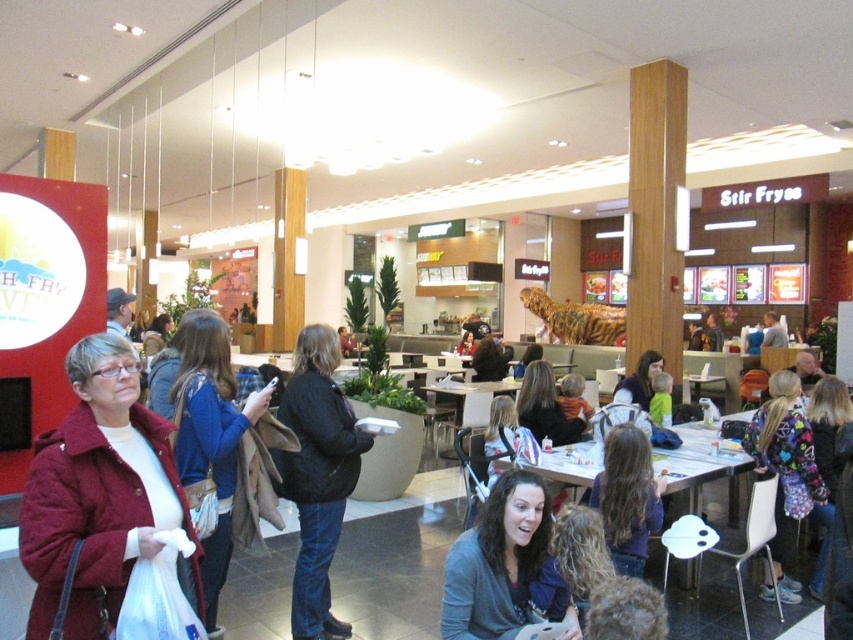
Question: Observing the image, what is the correct spatial positioning of blue fabric jacket at left in reference to white plastic table at center?

Choices:
 (A) left
 (B) right

Answer: (A)

Question: Which object appears farthest from the camera in this image?

Choices:
 (A) multicolored fleece jacket at lower right
 (B) blue fabric jacket at left
 (C) white plastic table at center
 (D) matte black jacket at center

Answer: (D)

Question: Does black matte jacket at center appear under matte black jacket at center?

Choices:
 (A) no
 (B) yes

Answer: (B)

Question: Which object is closer to the camera taking this photo?

Choices:
 (A) multicolored fleece jacket at lower right
 (B) black matte jacket at center

Answer: (B)

Question: Is dark purple sweater at center above matte black jacket at center?

Choices:
 (A) no
 (B) yes

Answer: (A)

Question: Which point is closer to the camera?

Choices:
 (A) matte black jacket at center
 (B) dark gray sweater at center

Answer: (B)